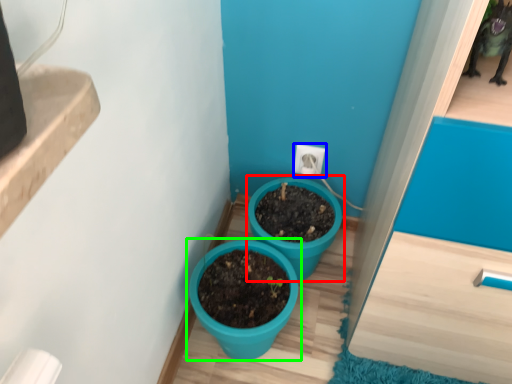
Question: Which object is the closest to the flowerpot (highlighted by a red box)? Choose among these: electric outlet (highlighted by a blue box) or flowerpot (highlighted by a green box).

Choices:
 (A) electric outlet
 (B) flowerpot

Answer: (B)